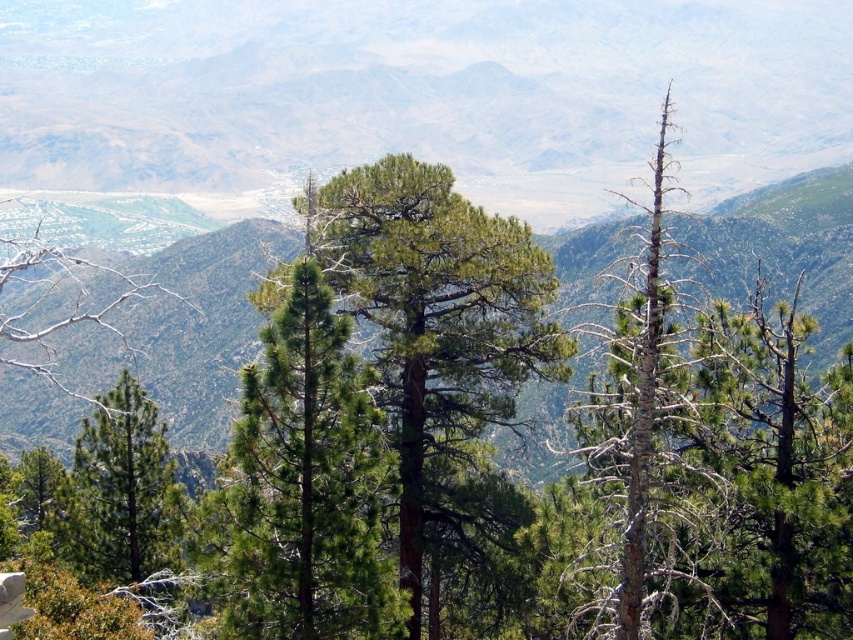
Question: Which point is farther from the camera taking this photo?

Choices:
 (A) (x=837, y=417)
 (B) (x=653, y=376)

Answer: (A)

Question: Does green needle-like at center appear on the right side of green needle-like at right?

Choices:
 (A) yes
 (B) no

Answer: (B)

Question: Is green rough bark tree at center positioned behind green needle-like at center?

Choices:
 (A) yes
 (B) no

Answer: (A)

Question: Estimate the real-world distances between objects in this image. Which object is farther from the brown rough bark tree at center right?

Choices:
 (A) green needle-like at center
 (B) green rough bark tree at center
 (C) green matte tree at left

Answer: (C)

Question: Which point is farther from the camera taking this photo?

Choices:
 (A) (263, 506)
 (B) (457, 268)

Answer: (B)

Question: Does green rough bark tree at center appear under green needle-like at center?

Choices:
 (A) no
 (B) yes

Answer: (A)